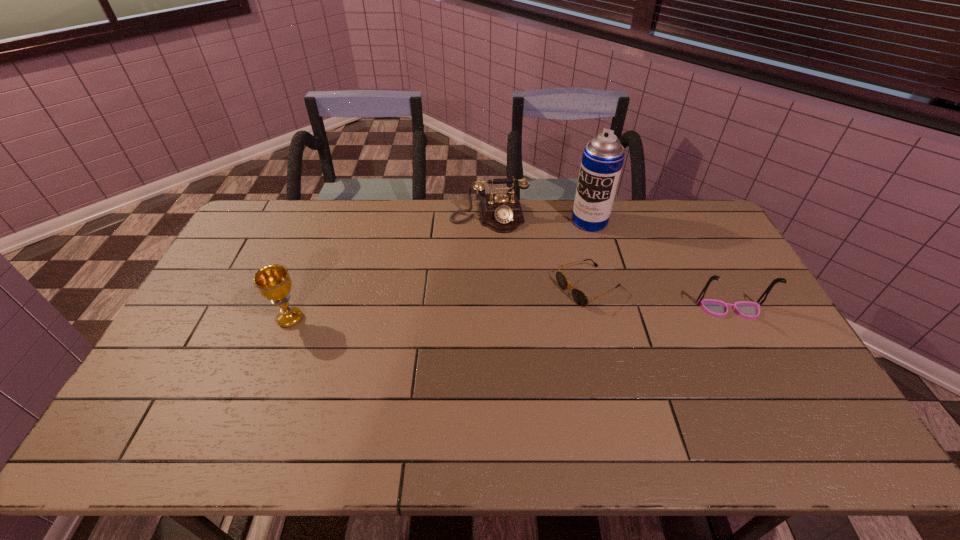
The image size is (960, 540). In order to click on free space at the left edge in this screenshot , I will do `click(209, 353)`.

This screenshot has height=540, width=960. Identify the location of vacant space at the right edge. (727, 280).

I want to click on vacant region at the far left corner, so click(271, 236).

Find the location of `vacant space at the near left corner`. vacant space at the near left corner is located at coordinates (204, 396).

The height and width of the screenshot is (540, 960). I want to click on empty space that is in between the spectacles and the aerosol can, so click(x=660, y=265).

Identify the location of empty location between the leftmost object and the telephone. This screenshot has height=540, width=960. (390, 268).

Where is `free point between the aerosol can and the sunglasses`? free point between the aerosol can and the sunglasses is located at coordinates (588, 254).

Find the location of a particular element. This screenshot has width=960, height=540. free spot between the rightmost object and the shortest object is located at coordinates (659, 299).

Identify the location of free point between the tallest object and the shortest object. (588, 254).

Where is `vacant area between the telephone and the leftmost object`? vacant area between the telephone and the leftmost object is located at coordinates (390, 268).